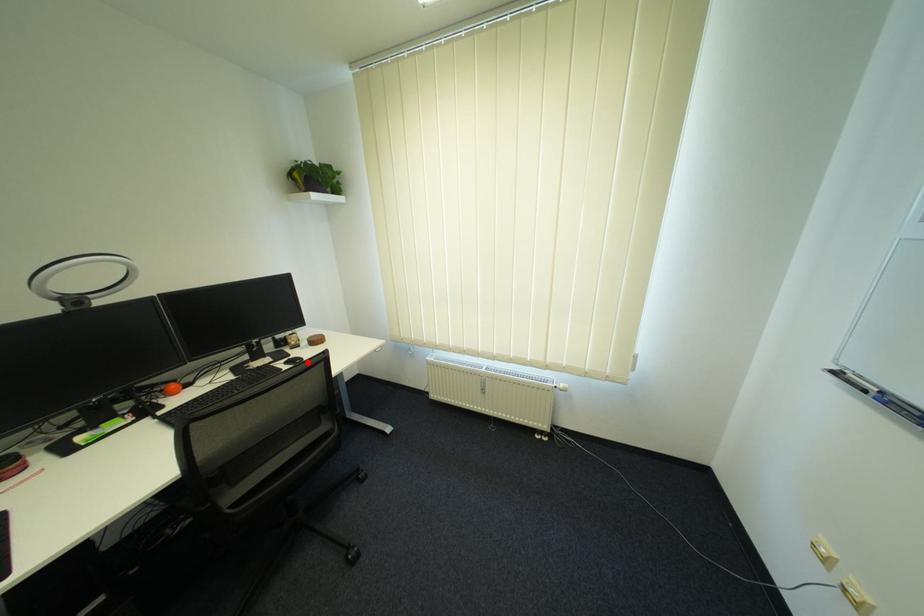
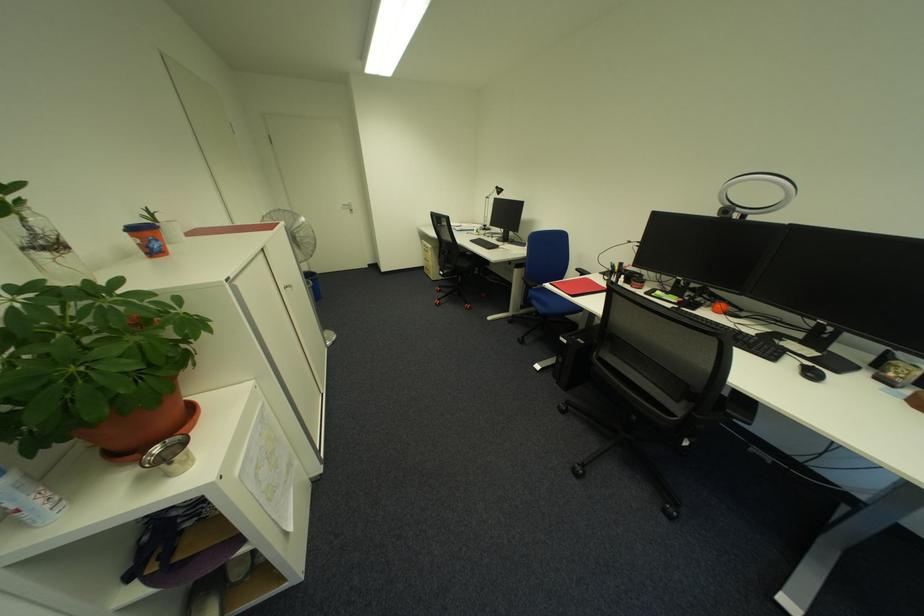
Question: I am providing you with two images of the same scene from different viewpoints. Image1 has a red point marked. In image2, the corresponding 3D location appears at what relative position? Reply with the corresponding letter.

Choices:
 (A) Closer
 (B) Farther

Answer: (A)